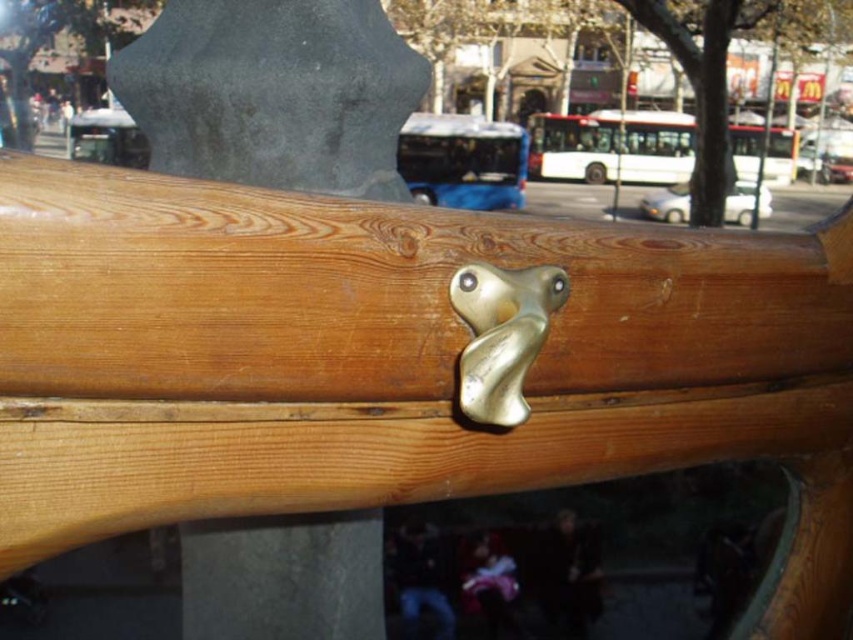
Question: Which point appears farthest from the camera in this image?

Choices:
 (A) (461, 364)
 (B) (358, 33)

Answer: (B)

Question: Can you confirm if matte wood handle at center is bigger than gold metallic door handle at center?

Choices:
 (A) yes
 (B) no

Answer: (A)

Question: Does matte wood handle at center appear on the left side of gold metallic door handle at center?

Choices:
 (A) no
 (B) yes

Answer: (B)

Question: Does matte wood handle at center appear on the right side of gold metallic door handle at center?

Choices:
 (A) no
 (B) yes

Answer: (A)

Question: Among these objects, which one is nearest to the camera?

Choices:
 (A) gold metallic door handle at center
 (B) matte wood handle at center

Answer: (A)